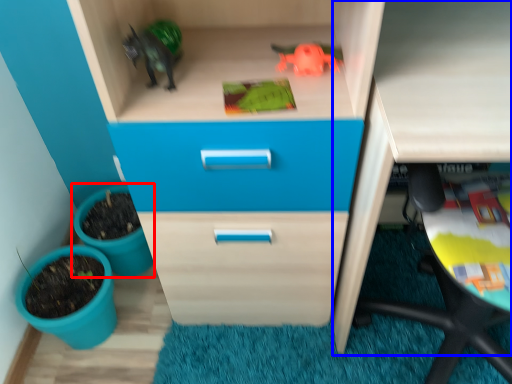
Question: Which object is closer to the camera taking this photo, flowerpot (highlighted by a red box) or computer desk (highlighted by a blue box)?

Choices:
 (A) flowerpot
 (B) computer desk

Answer: (B)